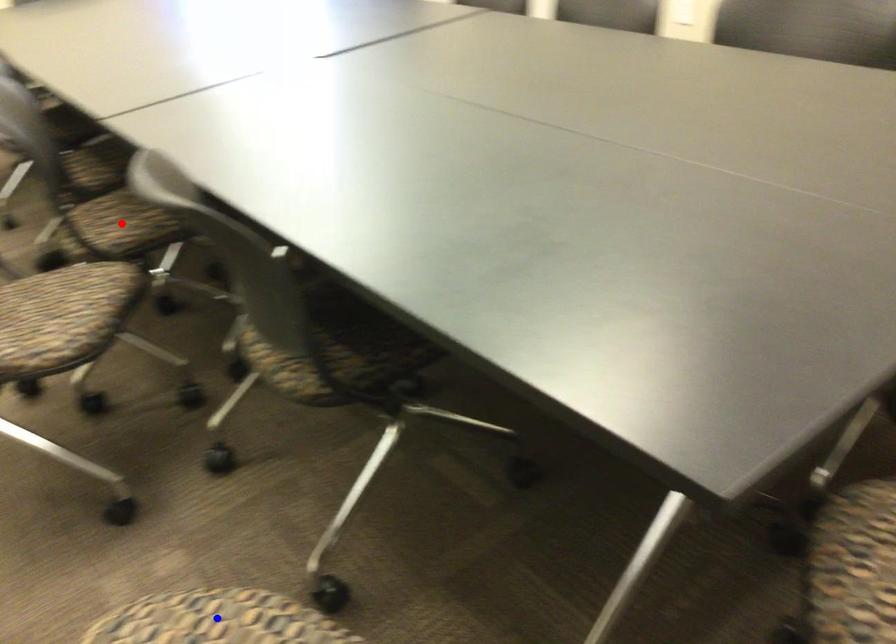
Question: In the image, two points are highlighted. Which point is nearer to the camera? Reply with the corresponding letter.

Choices:
 (A) blue point
 (B) red point

Answer: (A)